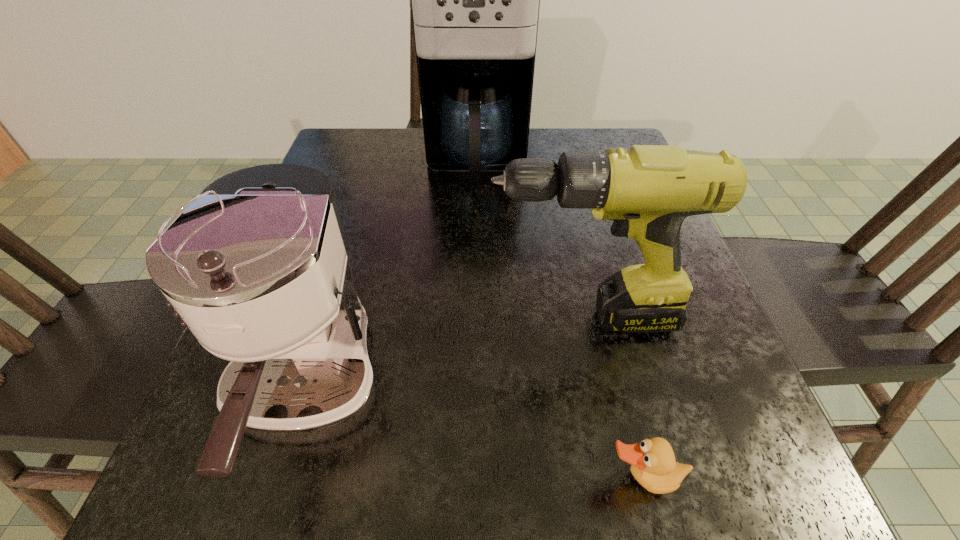
Identify the location of object that is at the far edge. (475, 0).

Find the location of a particular element. coffee maker that is at the near edge is located at coordinates (257, 267).

Where is `duck located in the near edge section of the desktop`? The height and width of the screenshot is (540, 960). duck located in the near edge section of the desktop is located at coordinates point(653,465).

Identify the location of object located in the left edge section of the desktop. The width and height of the screenshot is (960, 540). (257, 267).

This screenshot has height=540, width=960. Identify the location of drill that is positioned at the right edge. (647, 191).

The width and height of the screenshot is (960, 540). What are the coordinates of `duck present at the right edge` in the screenshot? It's located at (653, 465).

This screenshot has height=540, width=960. In order to click on object that is positioned at the near left corner in this screenshot , I will do `click(257, 267)`.

Where is `object present at the near right corner`? This screenshot has width=960, height=540. object present at the near right corner is located at coordinates (653, 465).

Where is `blank space at the far edge`? The width and height of the screenshot is (960, 540). blank space at the far edge is located at coordinates (418, 168).

The image size is (960, 540). I want to click on free spot at the near edge of the desktop, so click(x=466, y=482).